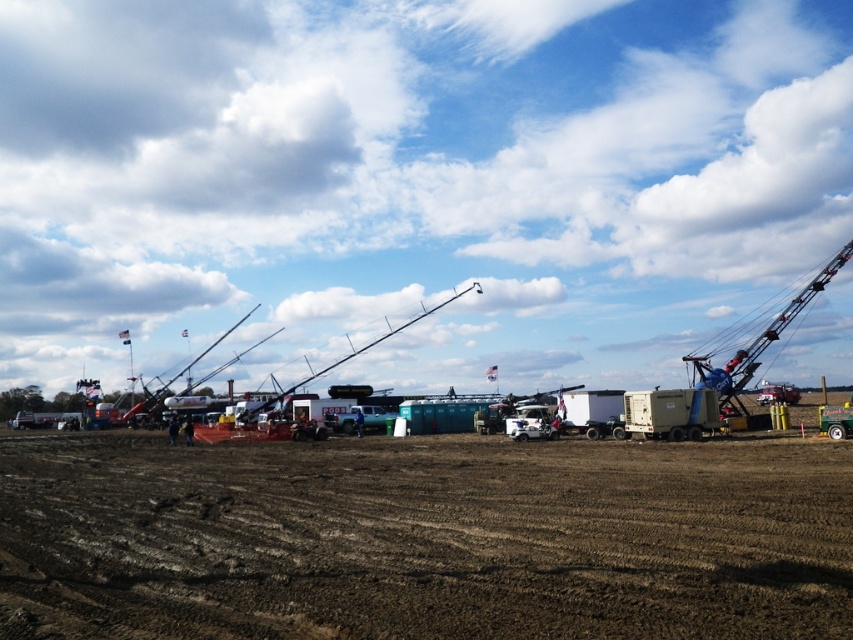
You are a delivery driver who needs to park your beige rubber trailer truck at center right near the brown soil at center. Can you park your truck there without overlapping the soil area?

The brown soil at center might be wider than beige rubber trailer truck at center right, so there is a possibility that the truck can be parked there without overlapping the soil area, but it depends on the exact dimensions.

You are a construction worker who needs to move a heavy crate from the brown soil at center to the beige rubber trailer truck at center right. The crate is 12 meters long. Can you safely transport it directly without needing to adjust the crate or the path?

The distance between the brown soil at center and the beige rubber trailer truck at center right is 12.18 meters. Since the crate is 12 meters long, it can be transported safely as the distance is slightly longer than the crate, allowing for safe movement without adjustments.